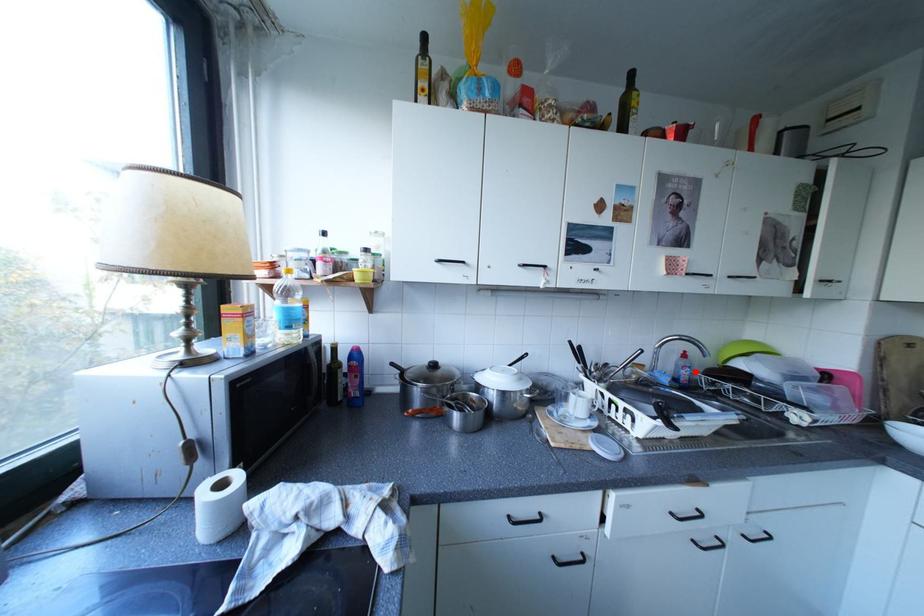
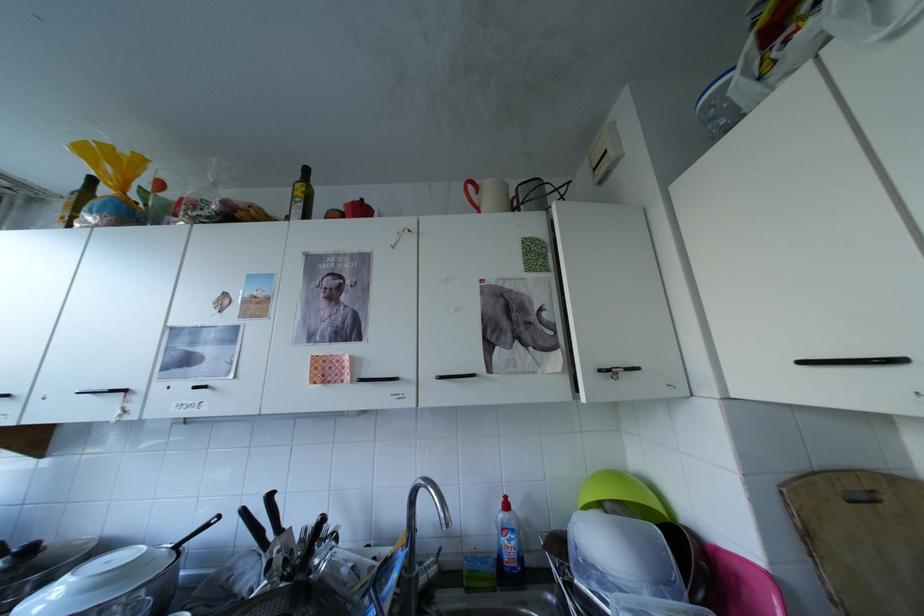
Find the pixel in the second image that matches the highlighted location in the first image.

(517, 541)